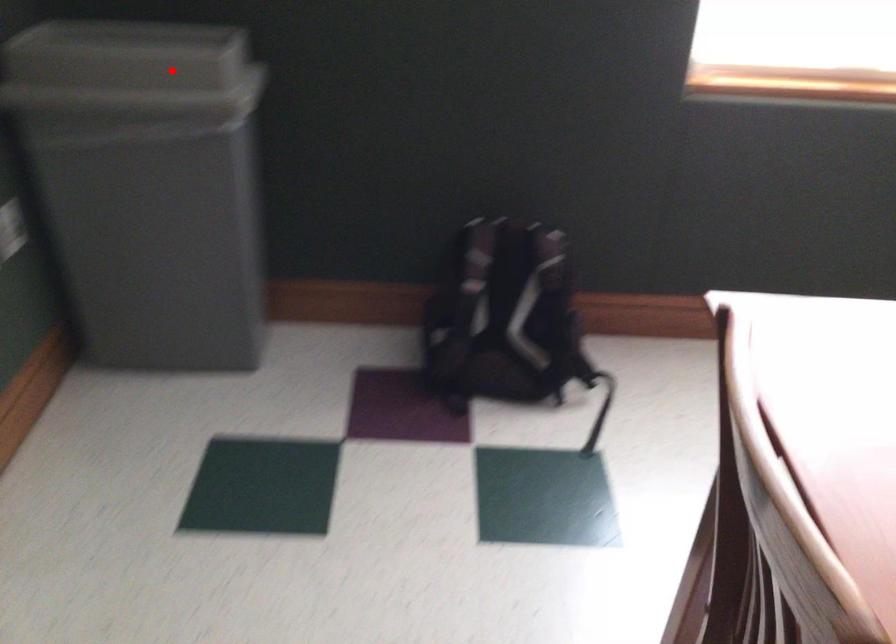
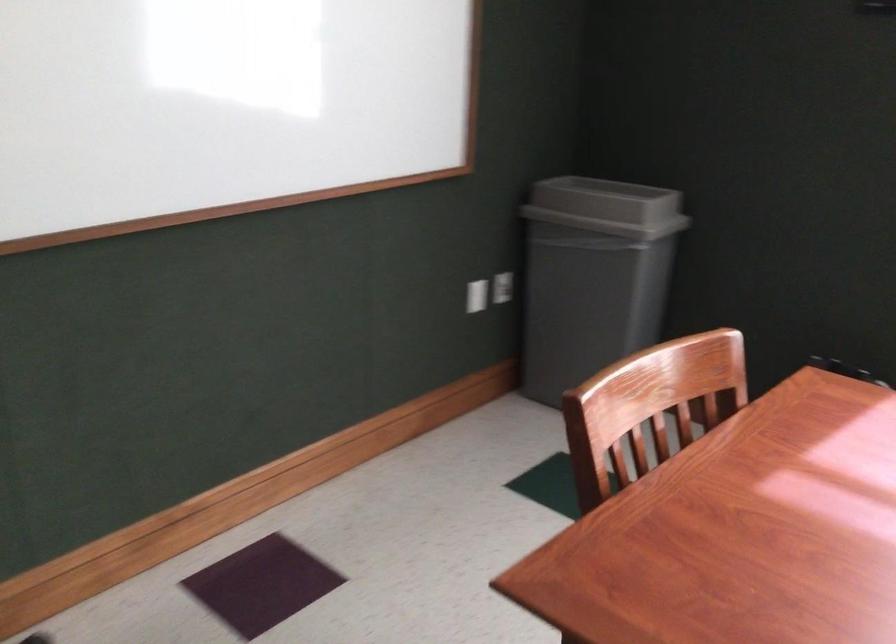
Question: I am providing you with two images of the same scene from different viewpoints. A red point is shown in image1. For the corresponding object point in image2, is it positioned nearer or farther from the camera?

Choices:
 (A) Nearer
 (B) Farther

Answer: (B)